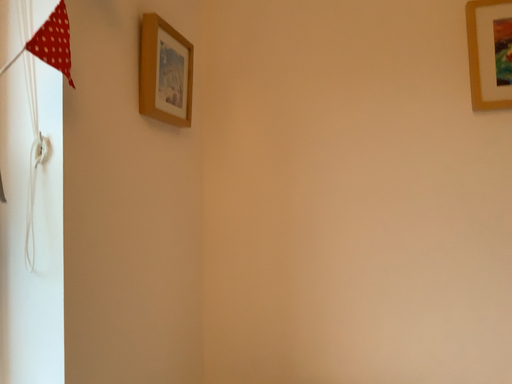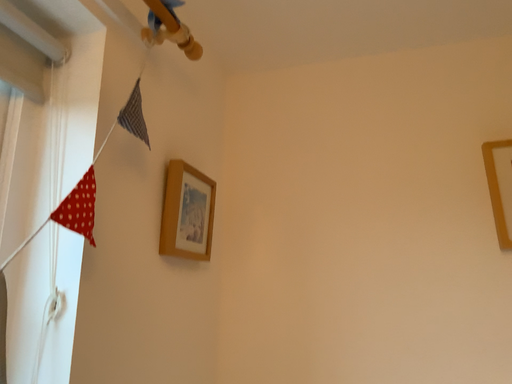
Question: How did the camera likely rotate when shooting the video?

Choices:
 (A) rotated downward
 (B) rotated upward

Answer: (B)